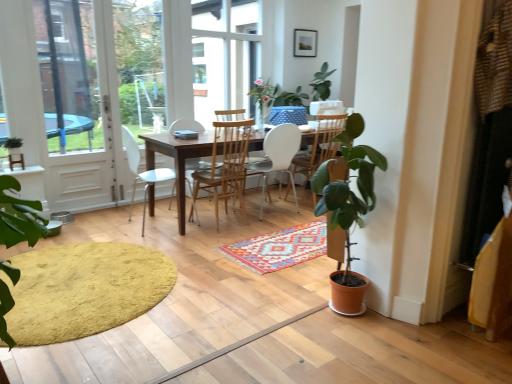
What do you see at coordinates (76, 102) in the screenshot? I see `white glass door at left` at bounding box center [76, 102].

Find the location of a particular element. This screenshot has height=384, width=512. green matte plant at left is located at coordinates (13, 143).

Describe the element at coordinates (177, 160) in the screenshot. The image size is (512, 384). I see `wooden table at center` at that location.

The height and width of the screenshot is (384, 512). What do you see at coordinates (305, 43) in the screenshot?
I see `matte black picture frame at upper center` at bounding box center [305, 43].

You are a GUI agent. You are given a task and a screenshot of the screen. Output one action in this format:
    pyautogui.click(x=<x>, y=<y>)
    Task: Click on the white plastic chair at center, positioned as the first chair in right-to-left order
    The width and height of the screenshot is (512, 384).
    Given the screenshot: What is the action you would take?
    [276, 157]

In terms of size, does wooden chair at center, arranged as the 2th chair when viewed from the left, appear bigger or smaller than matte black picture frame at upper center?

In the image, wooden chair at center, arranged as the 2th chair when viewed from the left, appears to be larger than matte black picture frame at upper center.

From the image's perspective, would you say wooden chair at center, arranged as the 2th chair when viewed from the left, is positioned over matte black picture frame at upper center?

No, from the image's perspective, wooden chair at center, arranged as the 2th chair when viewed from the left, is not above matte black picture frame at upper center.

Is wooden chair at center, arranged as the 2th chair when viewed from the left, not inside matte black picture frame at upper center?

wooden chair at center, arranged as the 2th chair when viewed from the left, is positioned outside matte black picture frame at upper center.

Is the position of wooden chair at center, which is the 2th chair in right-to-left order, more distant than that of matte black picture frame at upper center?

No, wooden chair at center, which is the 2th chair in right-to-left order, is in front of matte black picture frame at upper center.

From a real-world perspective, does yellow soft rug at lower left, which ranks as the first doormat in left-to-right order, stand above white glass door at left?

Incorrect, from a real-world perspective, yellow soft rug at lower left, which ranks as the first doormat in left-to-right order, is lower than white glass door at left.

Is yellow soft rug at lower left, the second doormat from the right, bigger than white glass door at left?

No.

Can you confirm if yellow soft rug at lower left, the second doormat from the right, is wider than white glass door at left?

Yes.

Which is more to the right, yellow soft rug at lower left, which ranks as the first doormat in left-to-right order, or white glass door at left?

Positioned to the right is yellow soft rug at lower left, which ranks as the first doormat in left-to-right order.

Are green matte plant at lower right and green matte plant at left beside each other?

green matte plant at lower right is not next to green matte plant at left, and they're not touching.

Can you tell me how much green matte plant at lower right and green matte plant at left differ in facing direction?

The angular difference between green matte plant at lower right and green matte plant at left is 87.3 degrees.

Is green matte plant at lower right oriented away from green matte plant at left?

green matte plant at lower right does not have its back to green matte plant at left.

Which object is closer to the camera taking this photo, green matte plant at lower right or green matte plant at left?

green matte plant at lower right.

In the scene shown: Is matte black picture frame at upper center beside green matte plant at left?

No, matte black picture frame at upper center is not in contact with green matte plant at left.

Considering the positions of objects matte black picture frame at upper center and green matte plant at left in the image provided, who is behind, matte black picture frame at upper center or green matte plant at left?

matte black picture frame at upper center is further away from the camera.

From a real-world perspective, is matte black picture frame at upper center positioned under green matte plant at left based on gravity?

No, from a real-world perspective, matte black picture frame at upper center is not below green matte plant at left.

Which is in front, point (298, 53) or point (13, 147)?

The point (13, 147) is more forward.

What's the angular difference between white plastic chair at center, the first chair viewed from the left, and multicolored woven rug at center, the 2th doormat when ordered from left to right,'s facing directions?

88.3 degrees.

Could you tell me if white plastic chair at center, which is the 3th chair from right to left, is turned towards multicolored woven rug at center, the 2th doormat when ordered from left to right?

No, white plastic chair at center, which is the 3th chair from right to left, is not oriented towards multicolored woven rug at center, the 2th doormat when ordered from left to right.

Which object is positioned more to the left, white plastic chair at center, the first chair viewed from the left, or multicolored woven rug at center, the 1th doormat viewed from the right?

From the viewer's perspective, white plastic chair at center, the first chair viewed from the left, appears more on the left side.

Which doormat is the 1st one when counting from the front of the white plastic chair at center, which is the 3th chair from right to left? Please provide its 2D coordinates.

[(280, 248)]

Is wooden chair at center, arranged as the 2th chair when viewed from the left, to the left of yellow soft rug at lower left, the second doormat from the right, from the viewer's perspective?

Incorrect, wooden chair at center, arranged as the 2th chair when viewed from the left, is not on the left side of yellow soft rug at lower left, the second doormat from the right.

Could you tell me if wooden chair at center, which is the 2th chair in right-to-left order, is facing yellow soft rug at lower left, which ranks as the first doormat in left-to-right order?

No, wooden chair at center, which is the 2th chair in right-to-left order, is not oriented towards yellow soft rug at lower left, which ranks as the first doormat in left-to-right order.

Is wooden chair at center, arranged as the 2th chair when viewed from the left, positioned before yellow soft rug at lower left, the second doormat from the right?

No, it is behind yellow soft rug at lower left, the second doormat from the right.

What's the angular difference between green matte plant at left and white plastic chair at center, the 3th chair from the left,'s facing directions?

The angle between the facing direction of green matte plant at left and the facing direction of white plastic chair at center, the 3th chair from the left, is 177 degrees.

Could you tell me if green matte plant at left is turned towards white plastic chair at center, positioned as the first chair in right-to-left order?

No, green matte plant at left is not oriented towards white plastic chair at center, positioned as the first chair in right-to-left order.

From the image's perspective, is green matte plant at left located above white plastic chair at center, positioned as the first chair in right-to-left order?

Correct, green matte plant at left appears higher than white plastic chair at center, positioned as the first chair in right-to-left order, in the image.

Image resolution: width=512 pixels, height=384 pixels. Find the location of `picture frame that is above the wooden chair at center, arranged as the 2th chair when viewed from the left (from the image's perspective)`. picture frame that is above the wooden chair at center, arranged as the 2th chair when viewed from the left (from the image's perspective) is located at coordinates click(305, 43).

Identify the location of doormat that is the 2nd one when counting downward from the white glass door at left (from the image's perspective). Image resolution: width=512 pixels, height=384 pixels. pos(84,290).

Considering their positions, is green matte plant at left positioned closer to white glass door at left than white plastic chair at center, the 3th chair from the left?

Based on the image, green matte plant at left appears to be nearer to white glass door at left.

Which object lies nearer to the anchor point matte black picture frame at upper center, green matte plant at lower right or white glass door at left?

The object closer to matte black picture frame at upper center is white glass door at left.

Considering their positions, is wooden table at center positioned further to white glass door at left than white plastic chair at center, the 3th chair from the left?

white plastic chair at center, the 3th chair from the left.

From the image, which object appears to be farther from green matte plant at left, matte black picture frame at upper center or white plastic chair at center, which is the 3th chair from right to left?

matte black picture frame at upper center is positioned further to the anchor green matte plant at left.

From the picture: Estimate the real-world distances between objects in this image. Which object is further from wooden table at center, white plastic chair at center, the first chair viewed from the left, or white glass door at left?

The object further to wooden table at center is white glass door at left.

When comparing their distances from multicolored woven rug at center, the 1th doormat viewed from the right, does matte black picture frame at upper center or wooden chair at center, arranged as the 2th chair when viewed from the left, seem further?

matte black picture frame at upper center is further to multicolored woven rug at center, the 1th doormat viewed from the right.

Based on their spatial positions, is white plastic chair at center, the 3th chair from the left, or yellow soft rug at lower left, which ranks as the first doormat in left-to-right order, further from wooden chair at center, which is the 2th chair in right-to-left order?

yellow soft rug at lower left, which ranks as the first doormat in left-to-right order.

Which object lies further to the anchor point wooden chair at center, which is the 2th chair in right-to-left order, white glass door at left or multicolored woven rug at center, the 2th doormat when ordered from left to right?

Among the two, white glass door at left is located further to wooden chair at center, which is the 2th chair in right-to-left order.

The image size is (512, 384). What are the coordinates of `doormat located between yellow soft rug at lower left, the second doormat from the right, and green matte plant at lower right in the left-right direction` in the screenshot? It's located at tap(280, 248).

Locate an element on the screen. kitchen & dining room table positioned between multicolored woven rug at center, the 1th doormat viewed from the right, and white plastic chair at center, positioned as the first chair in right-to-left order, from near to far is located at coordinates 177,160.

Where is `plant positioned between yellow soft rug at lower left, the second doormat from the right, and matte black picture frame at upper center from near to far`? This screenshot has width=512, height=384. plant positioned between yellow soft rug at lower left, the second doormat from the right, and matte black picture frame at upper center from near to far is located at coordinates point(13,143).

At what (x,y) coordinates should I click in order to perform the action: click on chair between green matte plant at left and wooden chair at center, which is the 2th chair in right-to-left order, in the horizontal direction. Please return your answer as a coordinate pair (x, y). Looking at the image, I should click on (144, 173).